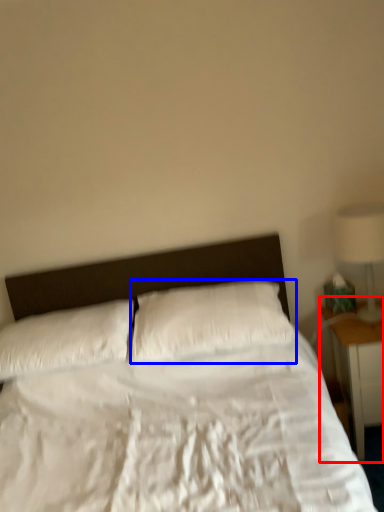
Question: Which object appears farthest to the camera in this image, nightstand (highlighted by a red box) or pillow (highlighted by a blue box)?

Choices:
 (A) nightstand
 (B) pillow

Answer: (A)